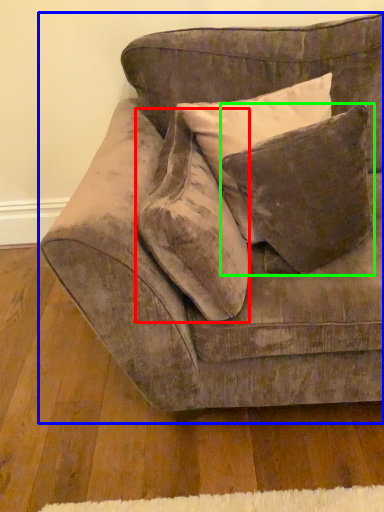
Question: Which is nearer to the throw pillow (highlighted by a red box)? studio couch (highlighted by a blue box) or pillow (highlighted by a green box).

Choices:
 (A) studio couch
 (B) pillow

Answer: (A)